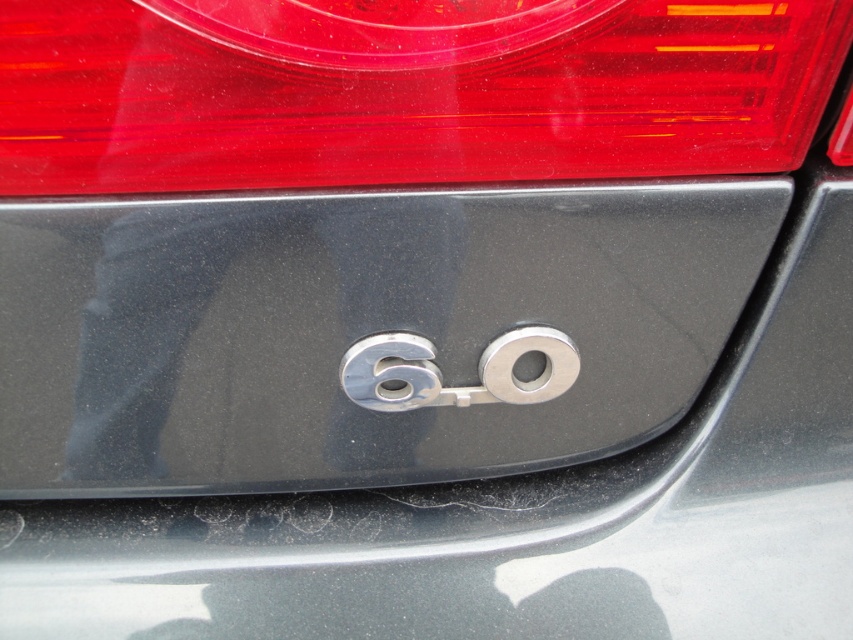
You are a photographer trying to capture a clear shot of the car emblem. You want to focus on the point at coordinates point (582, 296). Given that your camera has a depth of field that can clearly capture objects within 25 inches from the lens, will the point be in focus?

The distance of point (582, 296) from camera is 25.41 inches. Since the depth of field can clearly capture objects within 25 inches, the point is slightly beyond the clear focus range and may appear slightly out of focus.

You are a car detailer working on a vehicle and need to clean the metallic gray emblem at center and the chrome metallic number at center. If your cleaning tool can reach 3.5 inches, can you clean both objects without moving your tool?

The metallic gray emblem at center is 3.70 inches away from the chrome metallic number at center. Since the tool can only reach 3.5 inches, you cannot clean both objects without moving your tool.